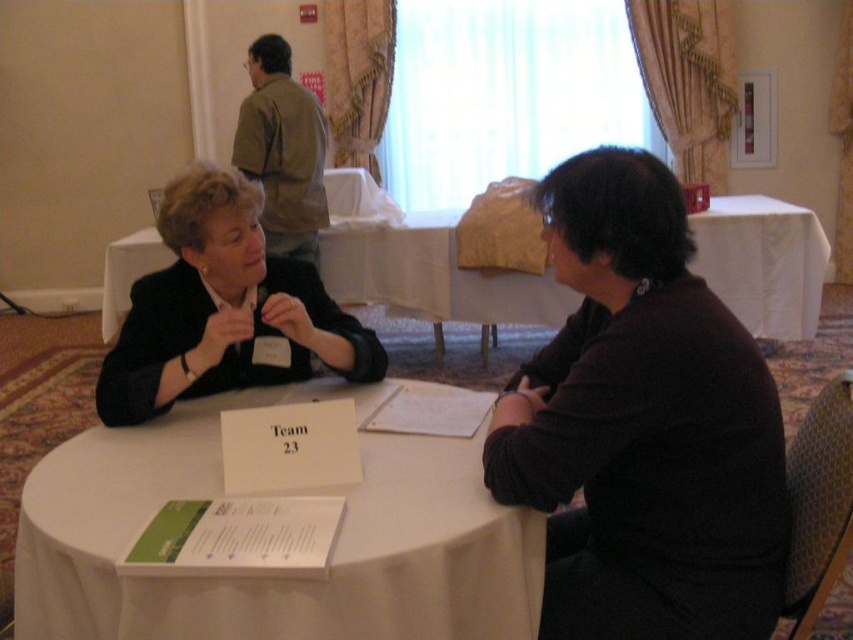
Question: Does white cloth-covered table at center lie behind white cloth at center?

Choices:
 (A) no
 (B) yes

Answer: (A)

Question: Which of the following is the closest to the observer?

Choices:
 (A) white cloth at center
 (B) white cloth-covered table at center
 (C) black matte jacket at center

Answer: (B)

Question: Is white cloth-covered table at center positioned in front of white cloth at center?

Choices:
 (A) no
 (B) yes

Answer: (B)

Question: Which object appears closest to the camera in this image?

Choices:
 (A) white cloth-covered table at center
 (B) white cloth at center
 (C) black matte jacket at center

Answer: (A)

Question: Which point is closer to the camera taking this photo?

Choices:
 (A) (35, 472)
 (B) (171, 339)

Answer: (A)

Question: Does white cloth-covered table at center come in front of white cloth at center?

Choices:
 (A) no
 (B) yes

Answer: (B)